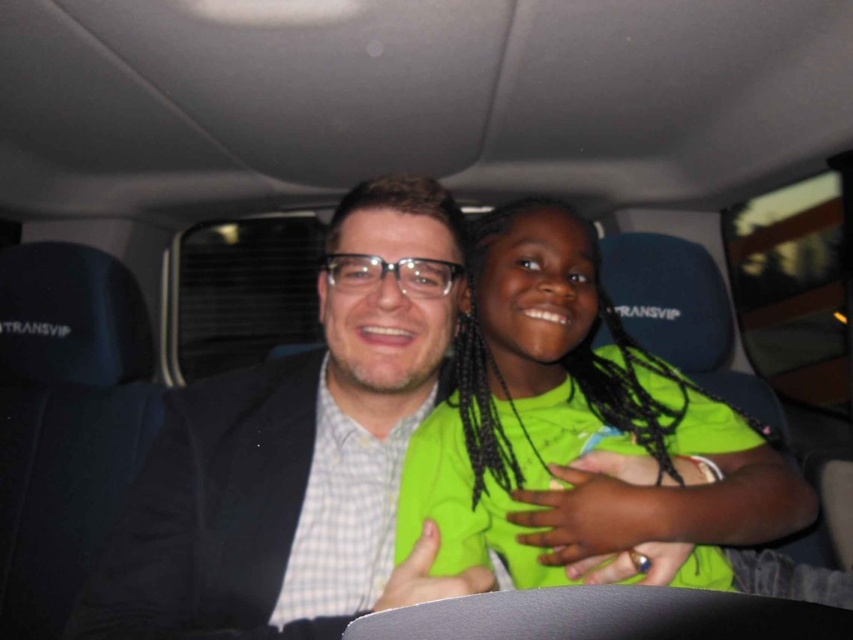
Where is the matte black suit at center located in the image?

The matte black suit at center is located at point (283, 452).

You are a photographer taking a picture of the two people in the vehicle. You notice the matte black suit at center and the neon green shirt at center. Which clothing item will appear larger in the photo?

The matte black suit at center is taller than neon green shirt at center, so it will appear larger in the photo.

You are designing a layout for a magazine article about the two individuals in the vehicle. The editor wants the photo to emphasize both subjects equally. Given the current arrangement of the matte black suit at center and neon green shirt at center, what adjustment could you make to balance their visual weight?

Since the matte black suit at center occupies less space than the neon green shirt at center, you could enlarge the matte black suit at center to match the size of the neon green shirt at center, ensuring both subjects have equal visual weight.